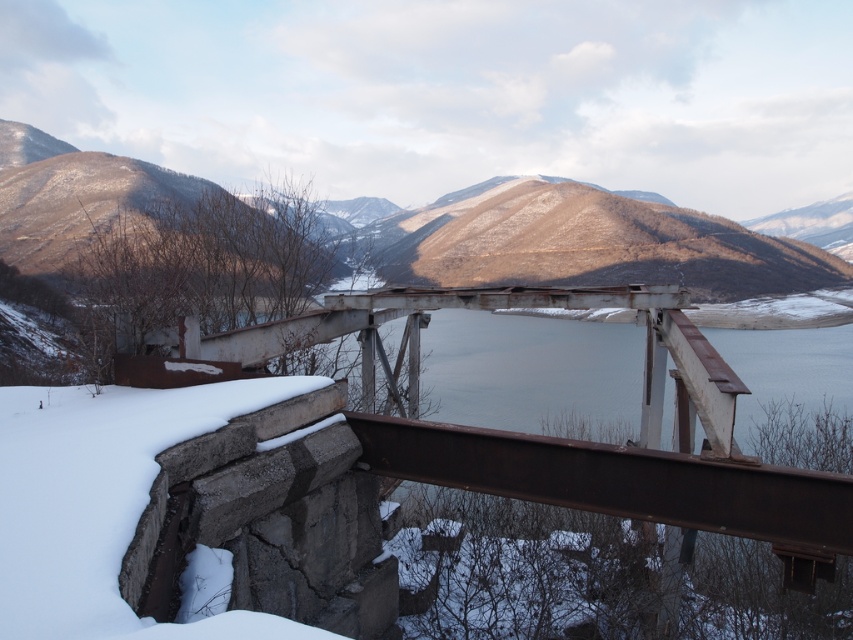
Does rusty metal bridge at center appear on the left side of brown textured mountain at center?

No, rusty metal bridge at center is not to the left of brown textured mountain at center.

Is rusty metal bridge at center wider than brown textured mountain at center?

In fact, rusty metal bridge at center might be narrower than brown textured mountain at center.

Measure the distance between rusty metal bridge at center and camera.

A distance of 13.02 feet exists between rusty metal bridge at center and camera.

Identify the location of rusty metal bridge at center. click(553, 438).